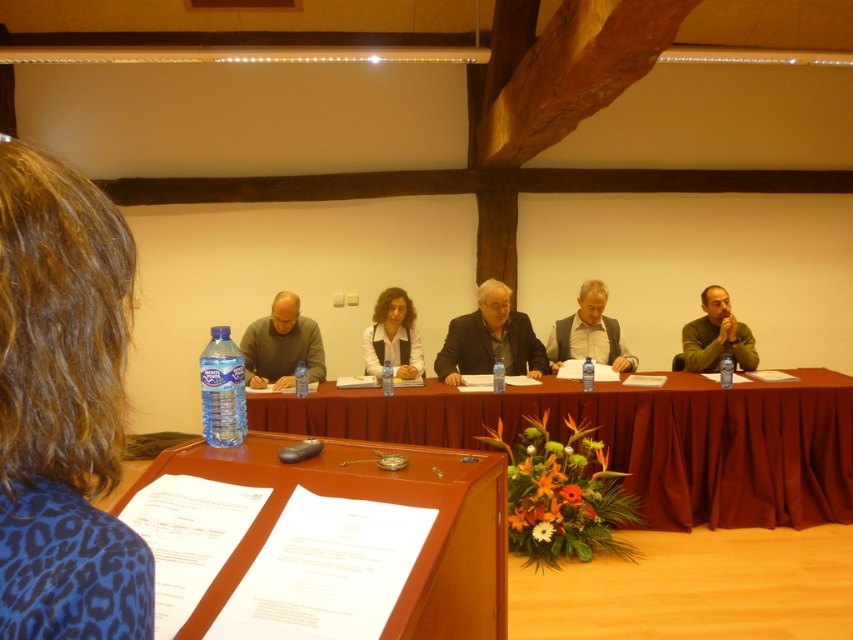
You are organizing a formal event and need to arrange two outfits displayed in the center of the room. The dark brown suit at center and the gray fabric jacket at center. Which one is on the left side?

The dark brown suit at center is positioned on the left side of the gray fabric jacket at center, so the dark brown suit at center is on the left.

You are an event organizer who needs to arrange the seating for a presentation. You see the dark brown suit at center and the gray fabric jacket at center. Which one is positioned lower in the image?

The dark brown suit at center is located below the gray fabric jacket at center, so it is positioned lower in the image.